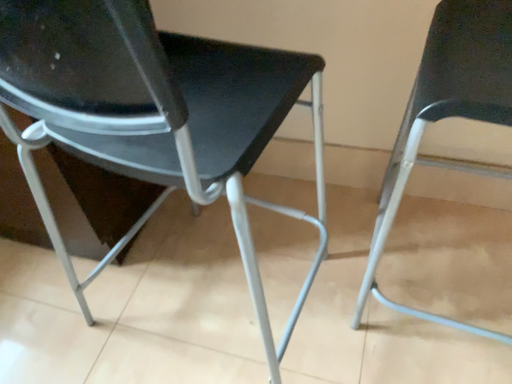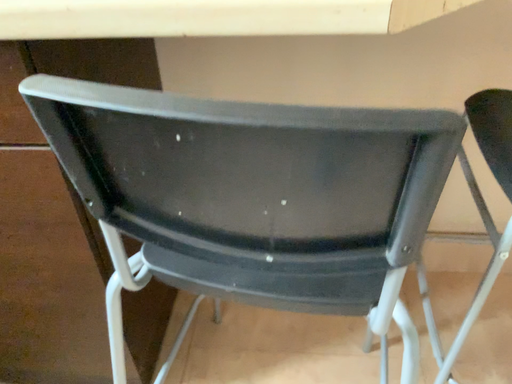
Question: Which way did the camera rotate in the video?

Choices:
 (A) rotated left
 (B) rotated right

Answer: (B)